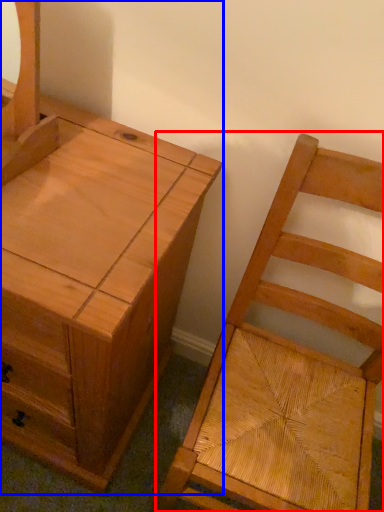
Question: Which object appears farthest to the camera in this image, chair (highlighted by a red box) or chest of drawers (highlighted by a blue box)?

Choices:
 (A) chair
 (B) chest of drawers

Answer: (B)